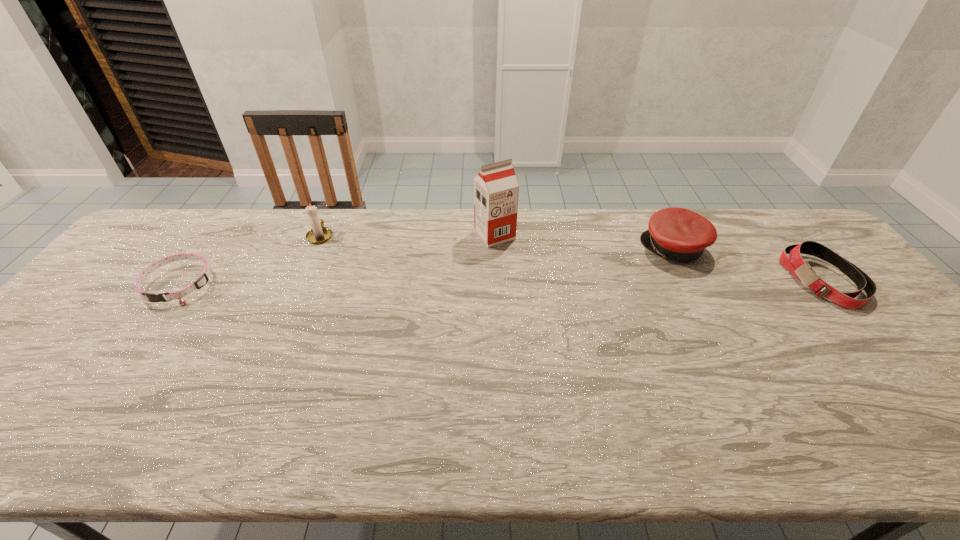
You are a GUI agent. You are given a task and a screenshot of the screen. Output one action in this format:
    pyautogui.click(x=<x>, y=<y>)
    Task: Click on the vacant space that satisfies the following two spatial constraints: 1. on the handle side of the third object from left to right; 2. on the left side of the candle holder
    The width and height of the screenshot is (960, 540).
    Given the screenshot: What is the action you would take?
    pyautogui.click(x=321, y=235)

Find the location of a particular element. vacant space that satisfies the following two spatial constraints: 1. at the front of the fourth object from left to right where the visor is located; 2. with the buckle on the shortest object is located at coordinates (693, 285).

In order to click on blank area in the image that satisfies the following two spatial constraints: 1. on the handle side of the tallest object; 2. on the left side of the second object from left to right in this screenshot , I will do `click(321, 235)`.